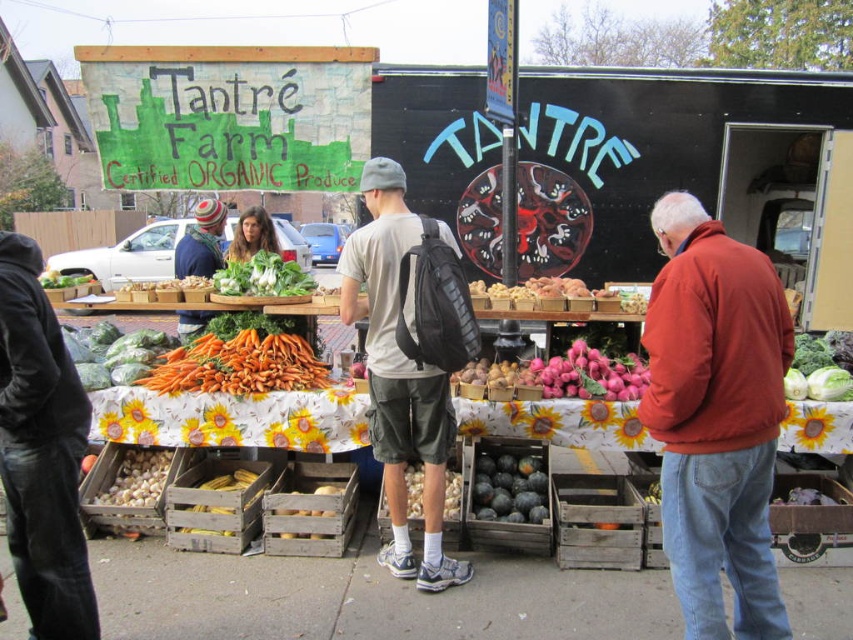
You are a customer at the farm stand and want to pick up both the orange matte carrots at center and the pink matte radish at center. If your basket can only hold items within a 1.5 meter reach, will you be able to collect both without moving your basket?

The orange matte carrots at center and pink matte radish at center are 1.55 meters apart from each other. Since your basket can only hold items within a 1.5 meter reach, the distance between them exceeds the basket capacity, so you cannot collect both without moving your basket.

Based on the photo, you are standing at the entrance of the farm stand and want to pick up the green leafy vegetables at lower left. According to the layout, where exactly are they positioned relative to the center of the stand?

The green leafy vegetables at lower left are located at coordinates point (113, 353), which places them slightly to the right and below the center of the stand.